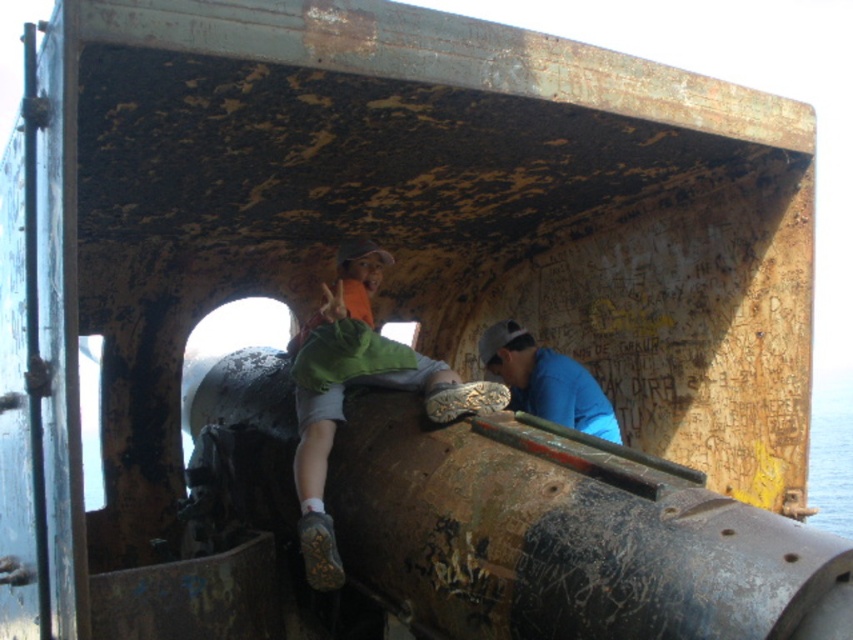
Question: Is green fabric shirt at center above blue matte shirt at center?

Choices:
 (A) no
 (B) yes

Answer: (B)

Question: Which point is closer to the camera?

Choices:
 (A) green fabric shirt at center
 (B) blue matte shirt at center

Answer: (A)

Question: From the image, what is the correct spatial relationship of green fabric shirt at center in relation to blue matte shirt at center?

Choices:
 (A) left
 (B) right

Answer: (A)

Question: Among these objects, which one is nearest to the camera?

Choices:
 (A) blue matte shirt at center
 (B) green fabric shirt at center

Answer: (B)

Question: Is green fabric shirt at center positioned at the back of blue matte shirt at center?

Choices:
 (A) no
 (B) yes

Answer: (A)